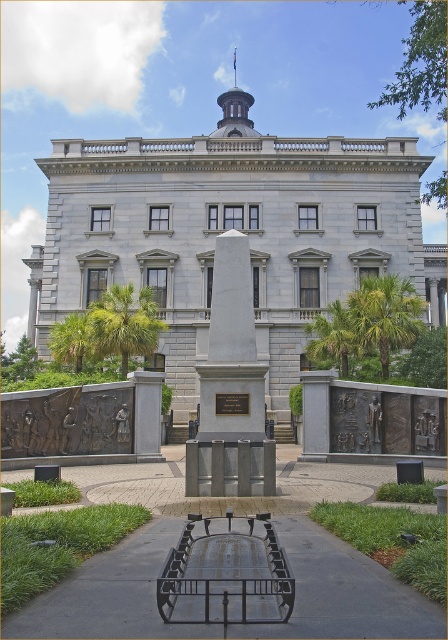
Question: Which point appears closest to the camera in this image?

Choices:
 (A) (274, 579)
 (B) (258, 380)

Answer: (A)

Question: Which point appears farthest from the camera in this image?

Choices:
 (A) (224, 573)
 (B) (220, 300)

Answer: (B)

Question: Which object is farther from the camera taking this photo?

Choices:
 (A) white marble obelisk at center
 (B) metallic park bench at center

Answer: (A)

Question: Can you confirm if metallic park bench at center is positioned to the left of white marble obelisk at center?

Choices:
 (A) no
 (B) yes

Answer: (A)

Question: In this image, where is metallic park bench at center located relative to white marble obelisk at center?

Choices:
 (A) right
 (B) left

Answer: (A)

Question: Is metallic park bench at center in front of white marble obelisk at center?

Choices:
 (A) no
 (B) yes

Answer: (B)